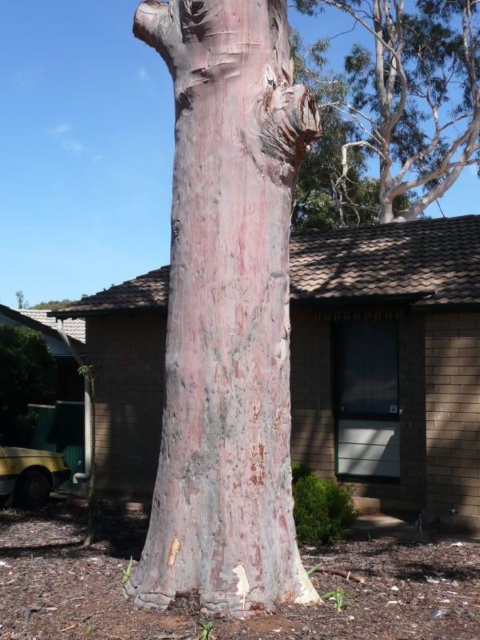
Does speckled bark tree trunk at center have a lesser width compared to green matte bush at lower left?

No, speckled bark tree trunk at center is not thinner than green matte bush at lower left.

The height and width of the screenshot is (640, 480). I want to click on speckled bark tree trunk at center, so click(x=227, y=310).

Does speckled bark tree trunk at center appear on the right side of smooth bark tree trunk at upper center?

In fact, speckled bark tree trunk at center is to the left of smooth bark tree trunk at upper center.

Is speckled bark tree trunk at center to the left of smooth bark tree trunk at upper center from the viewer's perspective?

Indeed, speckled bark tree trunk at center is positioned on the left side of smooth bark tree trunk at upper center.

Is point (272, 35) behind point (468, 90)?

That is False.

This screenshot has height=640, width=480. Find the location of `speckled bark tree trunk at center`. speckled bark tree trunk at center is located at coordinates (227, 310).

Who is more distant from viewer, (454, 29) or (39, 356)?

Positioned behind is point (454, 29).

Can you confirm if smooth bark tree trunk at upper center is wider than green matte bush at lower left?

Yes, smooth bark tree trunk at upper center is wider than green matte bush at lower left.

Is point (450, 17) positioned after point (37, 376)?

Yes.

Where is `smooth bark tree trunk at upper center`? smooth bark tree trunk at upper center is located at coordinates (414, 93).